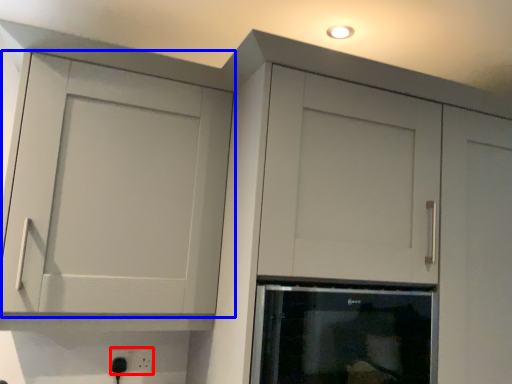
Question: Among these objects, which one is nearest to the camera, electric outlet (highlighted by a red box) or cupboard (highlighted by a blue box)?

Choices:
 (A) electric outlet
 (B) cupboard

Answer: (B)